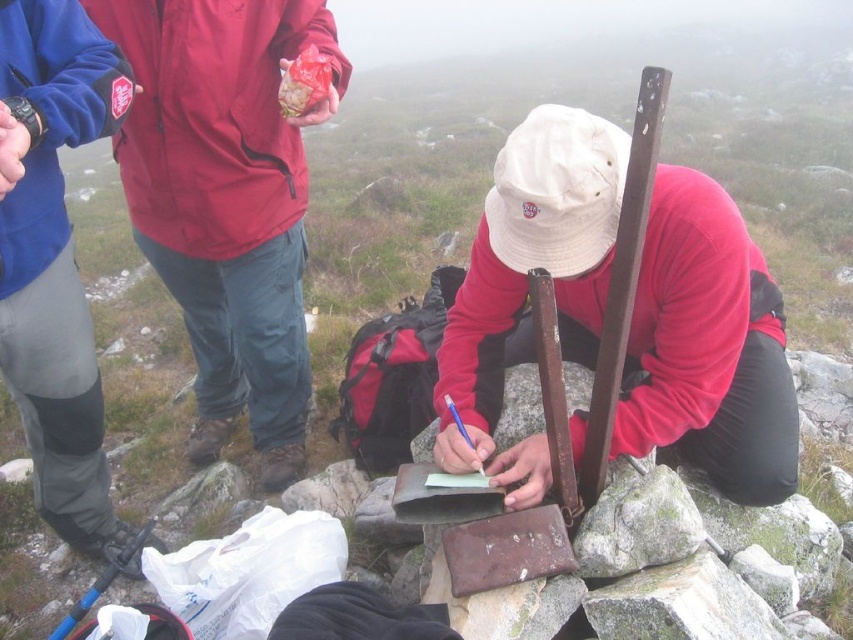
Is matte red shirt at center to the left of brushed metal jacket at upper left from the viewer's perspective?

In fact, matte red shirt at center is to the right of brushed metal jacket at upper left.

Is point (563, 339) positioned behind point (0, 246)?

Yes.

What are the coordinates of `matte red shirt at center` in the screenshot? It's located at (706, 346).

Between matte red jacket at left and brushed metal jacket at upper left, which one has less height?

With less height is brushed metal jacket at upper left.

Is point (184, 106) positioned after point (86, 310)?

No, it is in front of (86, 310).

I want to click on matte red jacket at left, so click(225, 200).

Locate an element on the screen. The image size is (853, 640). matte red jacket at left is located at coordinates (225, 200).

From the picture: Between matte red shirt at center and shiny plastic bag at upper center, which one appears on the left side from the viewer's perspective?

Positioned to the left is shiny plastic bag at upper center.

Does matte red shirt at center lie in front of shiny plastic bag at upper center?

That is True.

Which is behind, point (515, 456) or point (288, 72)?

Point (288, 72)

The image size is (853, 640). Identify the location of matte red shirt at center. (706, 346).